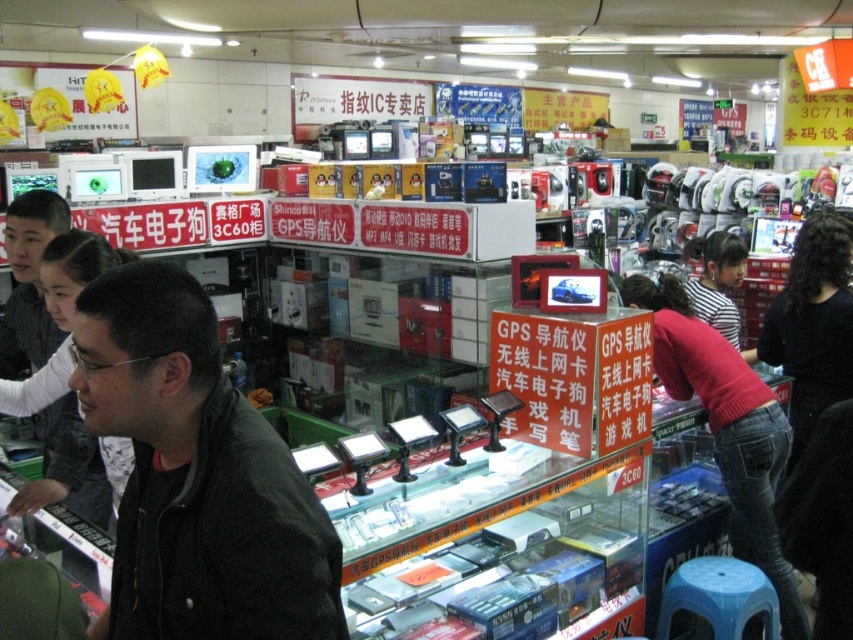
From the picture: Who is taller, red sweater at lower right or black matte shirt at right?

red sweater at lower right

Measure the distance between red sweater at lower right and camera.

red sweater at lower right is 2.67 meters away from camera.

This screenshot has width=853, height=640. What do you see at coordinates (727, 428) in the screenshot?
I see `red sweater at lower right` at bounding box center [727, 428].

Where is `red sweater at lower right`? The width and height of the screenshot is (853, 640). red sweater at lower right is located at coordinates (727, 428).

Does black matte jacket at lower left have a greater height compared to black matte jacket at left?

No, black matte jacket at lower left is not taller than black matte jacket at left.

Locate an element on the screen. black matte jacket at lower left is located at coordinates (196, 476).

Is the position of red sweater at lower right less distant than that of striped shirt at center?

That is True.

Can you confirm if red sweater at lower right is positioned above striped shirt at center?

Incorrect, red sweater at lower right is not positioned above striped shirt at center.

Image resolution: width=853 pixels, height=640 pixels. Identify the location of red sweater at lower right. (727, 428).